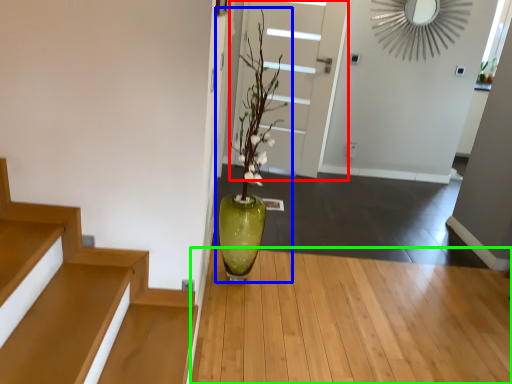
Question: Estimate the real-world distances between objects in this image. Which object is farther from door (highlighted by a red box), houseplant (highlighted by a blue box) or hardwood (highlighted by a green box)?

Choices:
 (A) houseplant
 (B) hardwood

Answer: (B)